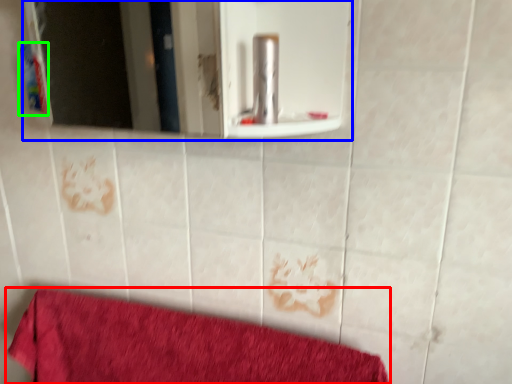
Question: Which object is the closest to the towel (highlighted by a red box)? Choose among these: mirror (highlighted by a blue box) or toiletry (highlighted by a green box).

Choices:
 (A) mirror
 (B) toiletry

Answer: (B)